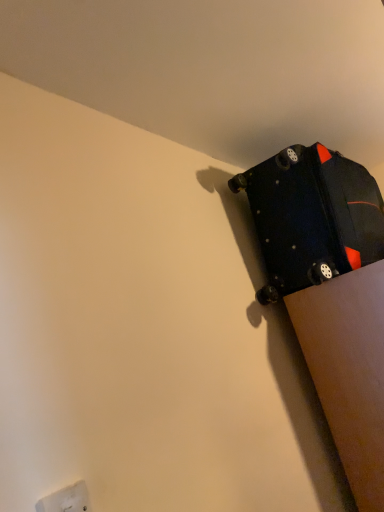
Question: From the image's perspective, does matte black suitcase at upper right appear higher than white plastic electric outlet at lower left?

Choices:
 (A) no
 (B) yes

Answer: (B)

Question: From the image's perspective, is matte black suitcase at upper right beneath white plastic electric outlet at lower left?

Choices:
 (A) no
 (B) yes

Answer: (A)

Question: Does matte black suitcase at upper right come behind white plastic electric outlet at lower left?

Choices:
 (A) no
 (B) yes

Answer: (B)

Question: Does matte black suitcase at upper right appear on the left side of white plastic electric outlet at lower left?

Choices:
 (A) yes
 (B) no

Answer: (B)

Question: Is matte black suitcase at upper right touching white plastic electric outlet at lower left?

Choices:
 (A) no
 (B) yes

Answer: (A)

Question: Is matte black suitcase at upper right bigger than white plastic electric outlet at lower left?

Choices:
 (A) no
 (B) yes

Answer: (B)

Question: Is white plastic electric outlet at lower left far away from matte black suitcase at upper right?

Choices:
 (A) no
 (B) yes

Answer: (B)

Question: Can you confirm if white plastic electric outlet at lower left is taller than matte black suitcase at upper right?

Choices:
 (A) no
 (B) yes

Answer: (A)

Question: Is white plastic electric outlet at lower left placed right next to matte black suitcase at upper right?

Choices:
 (A) yes
 (B) no

Answer: (B)

Question: Can you confirm if white plastic electric outlet at lower left is wider than matte black suitcase at upper right?

Choices:
 (A) yes
 (B) no

Answer: (B)

Question: Considering the relative sizes of white plastic electric outlet at lower left and matte black suitcase at upper right in the image provided, is white plastic electric outlet at lower left smaller than matte black suitcase at upper right?

Choices:
 (A) yes
 (B) no

Answer: (A)

Question: Would you say white plastic electric outlet at lower left is outside matte black suitcase at upper right?

Choices:
 (A) no
 (B) yes

Answer: (B)

Question: In the image, is white plastic electric outlet at lower left positioned in front of or behind matte black suitcase at upper right?

Choices:
 (A) front
 (B) behind

Answer: (A)